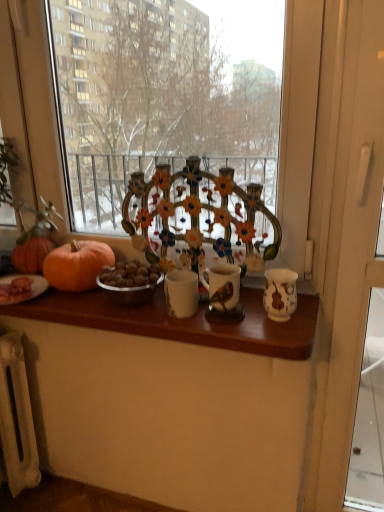
Image resolution: width=384 pixels, height=512 pixels. I want to click on vacant space to the right of matte ceramic candle holder at center, so click(x=274, y=325).